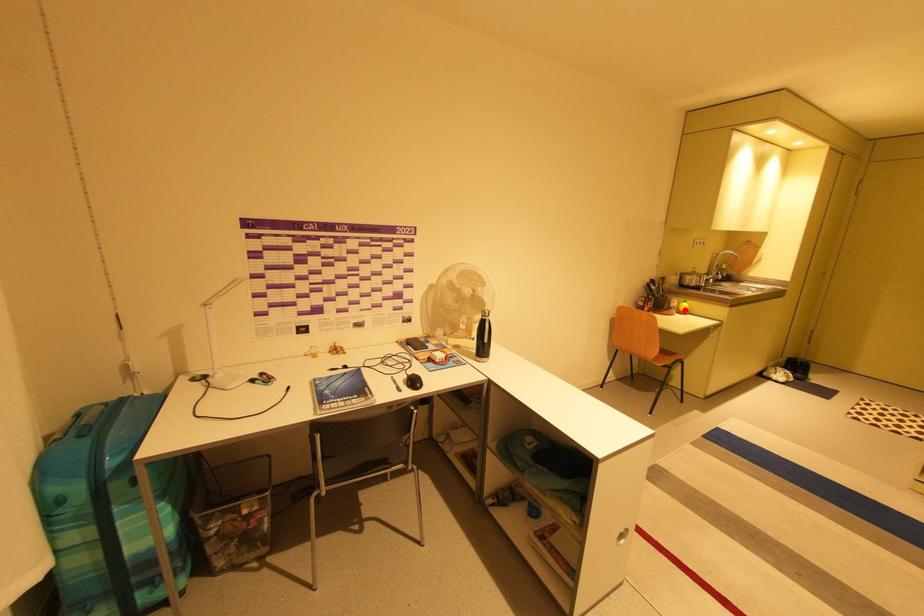
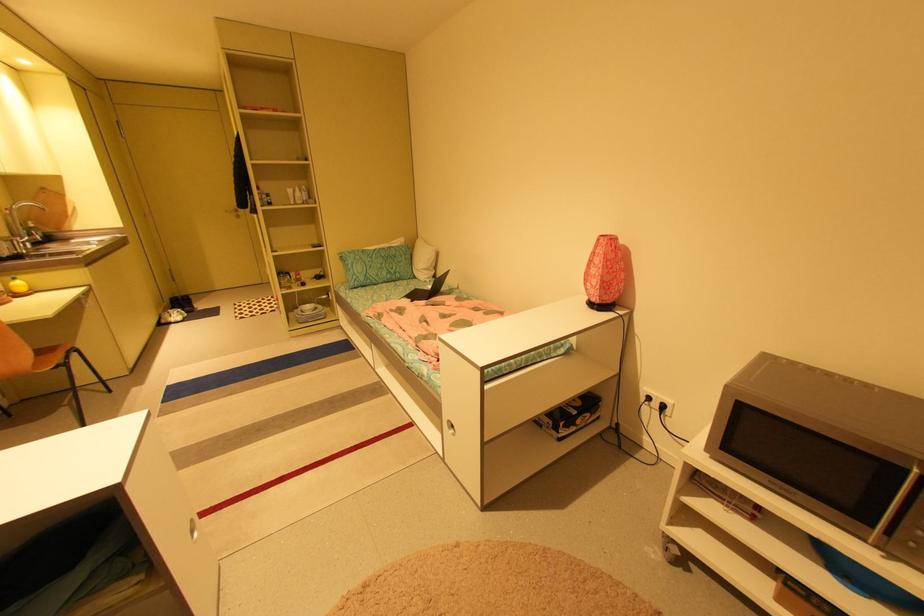
Locate, in the second image, the point that corresponds to the highlighted location in the first image.

(19, 293)